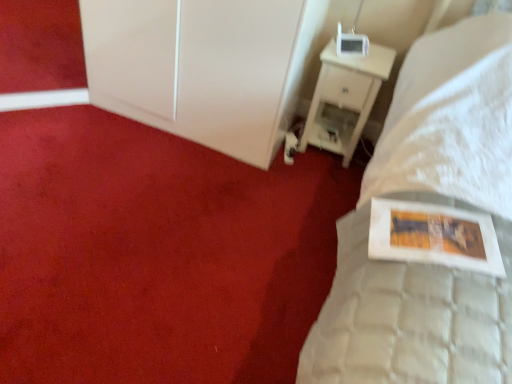
Question: Is white glossy cabinet at upper left not close to white wood nightstand at upper right?

Choices:
 (A) yes
 (B) no

Answer: (B)

Question: Does white glossy cabinet at upper left have a greater height compared to white wood nightstand at upper right?

Choices:
 (A) no
 (B) yes

Answer: (B)

Question: Considering the relative sizes of white glossy cabinet at upper left and white wood nightstand at upper right in the image provided, is white glossy cabinet at upper left shorter than white wood nightstand at upper right?

Choices:
 (A) no
 (B) yes

Answer: (A)

Question: Is white glossy cabinet at upper left next to white wood nightstand at upper right and touching it?

Choices:
 (A) yes
 (B) no

Answer: (B)

Question: Is white glossy cabinet at upper left closer to camera compared to white wood nightstand at upper right?

Choices:
 (A) yes
 (B) no

Answer: (A)

Question: Is white wood nightstand at upper right surrounded by white glossy cabinet at upper left?

Choices:
 (A) no
 (B) yes

Answer: (A)

Question: Is white glossy cabinet at upper left completely or partially inside white wood nightstand at upper right?

Choices:
 (A) no
 (B) yes

Answer: (A)

Question: Is white wood nightstand at upper right to the left of white glossy cabinet at upper left from the viewer's perspective?

Choices:
 (A) yes
 (B) no

Answer: (B)

Question: Is white wood nightstand at upper right smaller than white glossy cabinet at upper left?

Choices:
 (A) no
 (B) yes

Answer: (B)

Question: From the image's perspective, is white wood nightstand at upper right beneath white glossy cabinet at upper left?

Choices:
 (A) no
 (B) yes

Answer: (B)

Question: Considering the relative sizes of white wood nightstand at upper right and white glossy cabinet at upper left in the image provided, is white wood nightstand at upper right shorter than white glossy cabinet at upper left?

Choices:
 (A) yes
 (B) no

Answer: (A)

Question: Is white wood nightstand at upper right wider than white glossy cabinet at upper left?

Choices:
 (A) no
 (B) yes

Answer: (A)

Question: Is white glossy picture frame at upper right closer to the viewer compared to white wood nightstand at upper right?

Choices:
 (A) no
 (B) yes

Answer: (B)